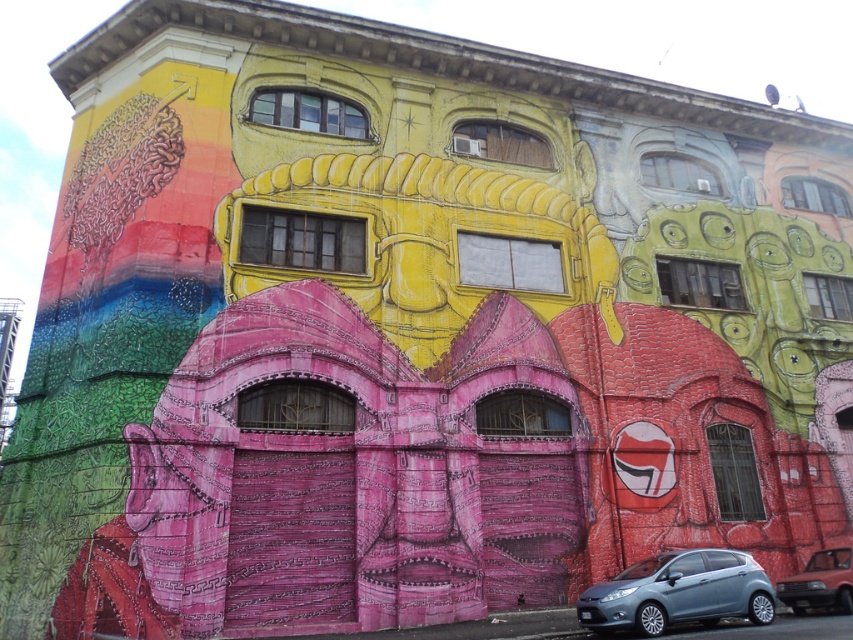
Which is more to the right, satin blue hatchback at lower center or metallic red car at lower right?

From the viewer's perspective, metallic red car at lower right appears more on the right side.

Who is shorter, satin blue hatchback at lower center or metallic red car at lower right?

metallic red car at lower right is shorter.

The image size is (853, 640). Identify the location of satin blue hatchback at lower center. (677, 593).

Identify the location of satin blue hatchback at lower center. Image resolution: width=853 pixels, height=640 pixels. (677, 593).